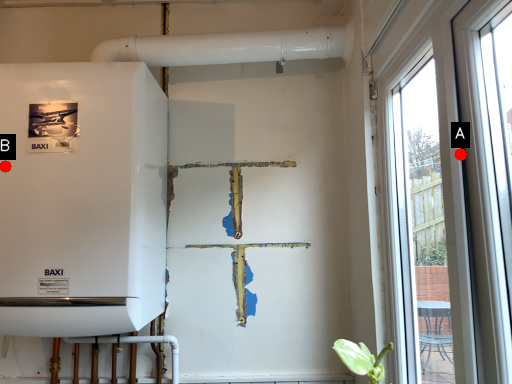
Question: Two points are circled on the image, labeled by A and B beside each circle. Among these points, which one is nearest to the camera?

Choices:
 (A) A is closer
 (B) B is closer

Answer: (A)